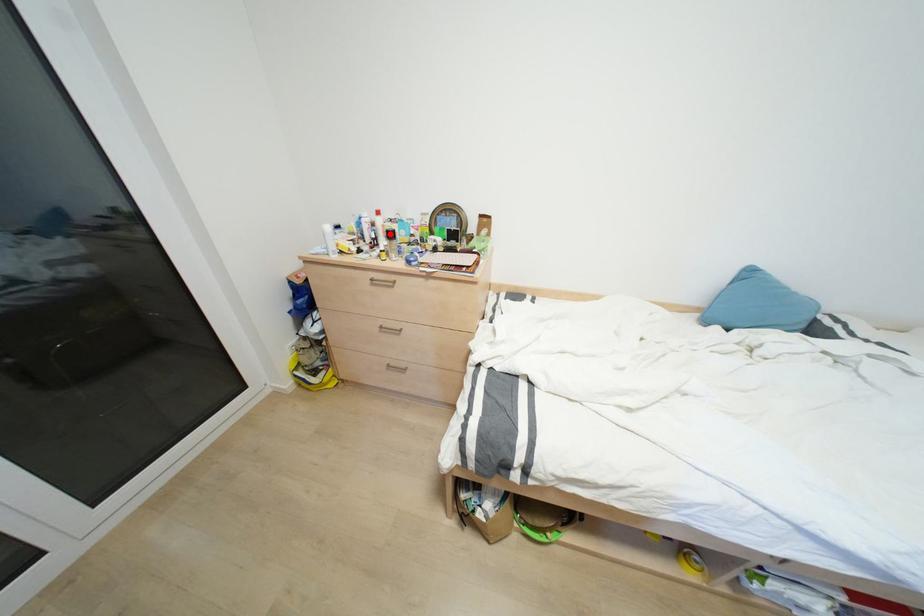
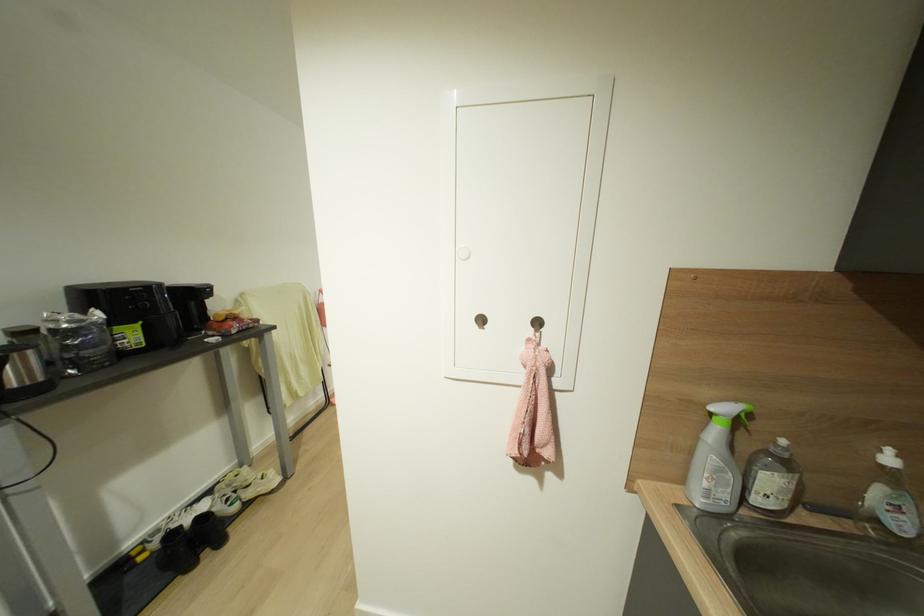
Question: I am providing you with two images of the same scene from different viewpoints. A red point is marked on the first image. At the location where the point appears in image 1, is it still visible in image 2?

Choices:
 (A) Yes
 (B) No

Answer: (B)